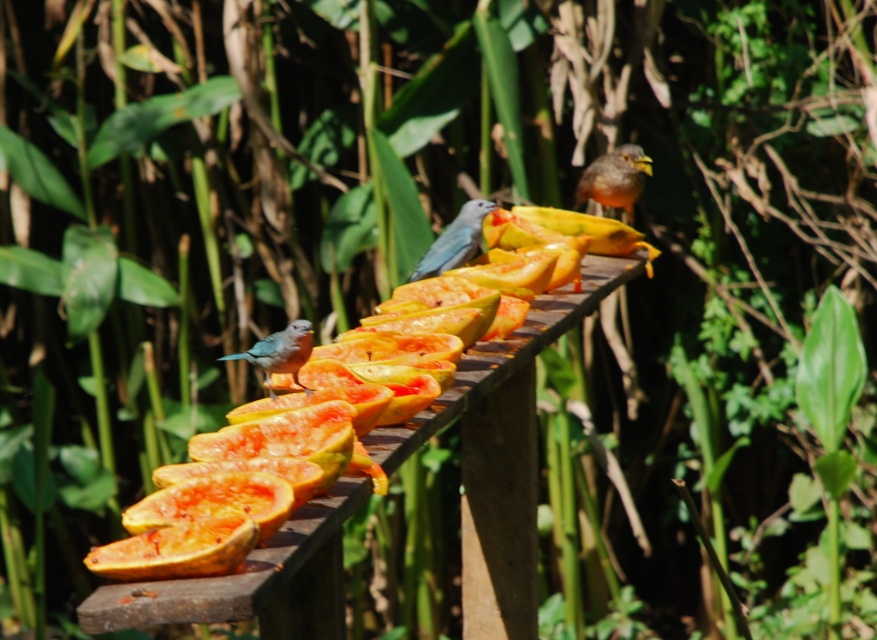
Between orange papaya at center and blue glossy bird at lower left, which one is positioned higher?

orange papaya at center is higher up.

Is orange papaya at center above blue glossy bird at lower left?

Yes, orange papaya at center is above blue glossy bird at lower left.

Looking at this image, measure the distance between point (562, 321) and camera.

They are 4.92 meters apart.

This screenshot has width=877, height=640. I want to click on orange papaya at center, so click(x=530, y=317).

Can you confirm if blue matte bird at center is wider than blue glossy bird at lower left?

Yes.

Is blue matte bird at center shorter than blue glossy bird at lower left?

No.

The image size is (877, 640). I want to click on blue matte bird at center, so click(x=454, y=241).

This screenshot has height=640, width=877. In order to click on blue matte bird at center in this screenshot , I will do `click(454, 241)`.

The image size is (877, 640). Identify the location of orange papaya at center. (530, 317).

The image size is (877, 640). Find the location of `orange papaya at center`. orange papaya at center is located at coordinates (530, 317).

Locate an element on the screen. This screenshot has height=640, width=877. orange papaya at center is located at coordinates (530, 317).